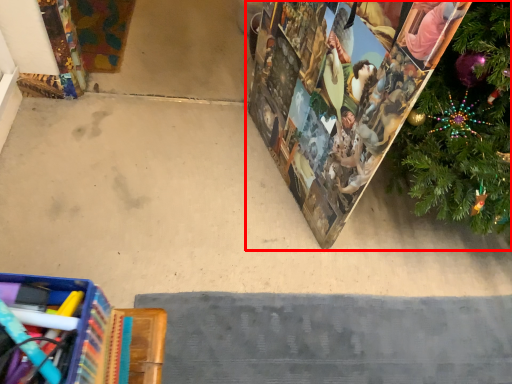
Question: From the image's perspective, what is the correct spatial positioning of christmas decoration (annotated by the red box) in reference to concrete?

Choices:
 (A) below
 (B) above

Answer: (B)